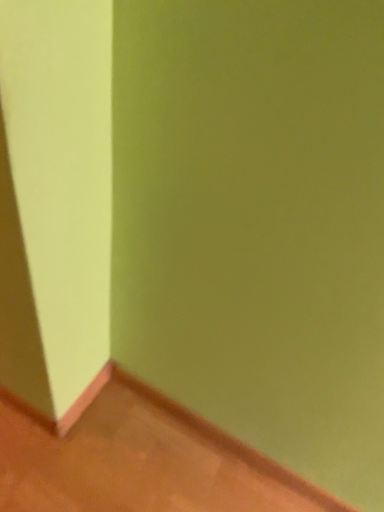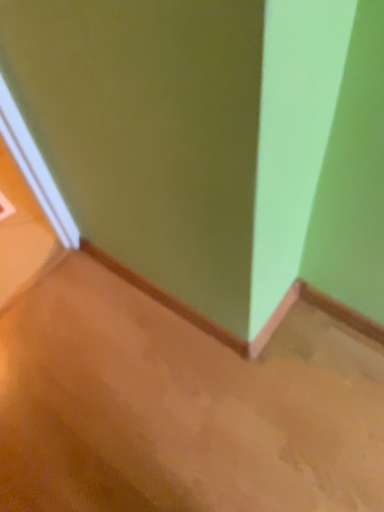
Question: How did the camera likely rotate when shooting the video?

Choices:
 (A) rotated left
 (B) rotated right

Answer: (A)